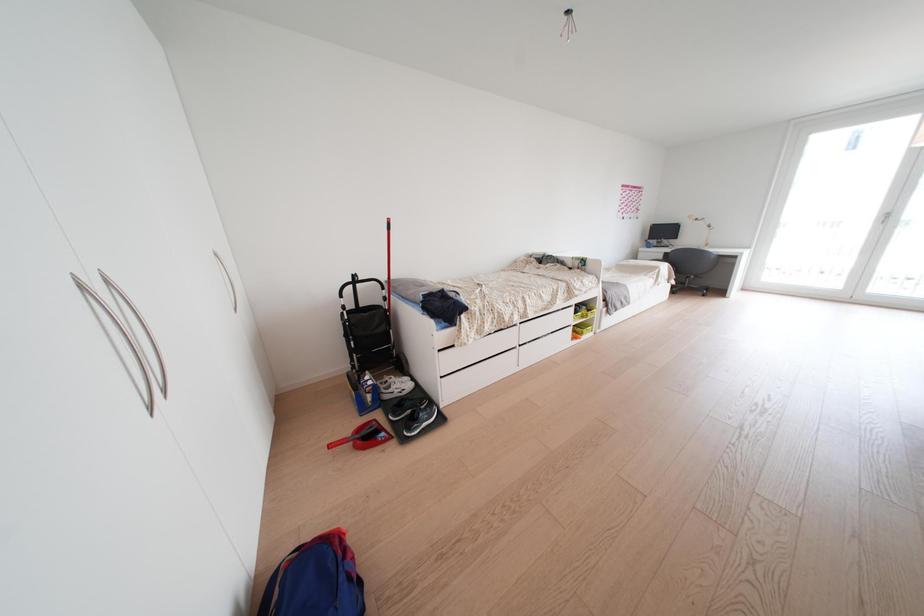
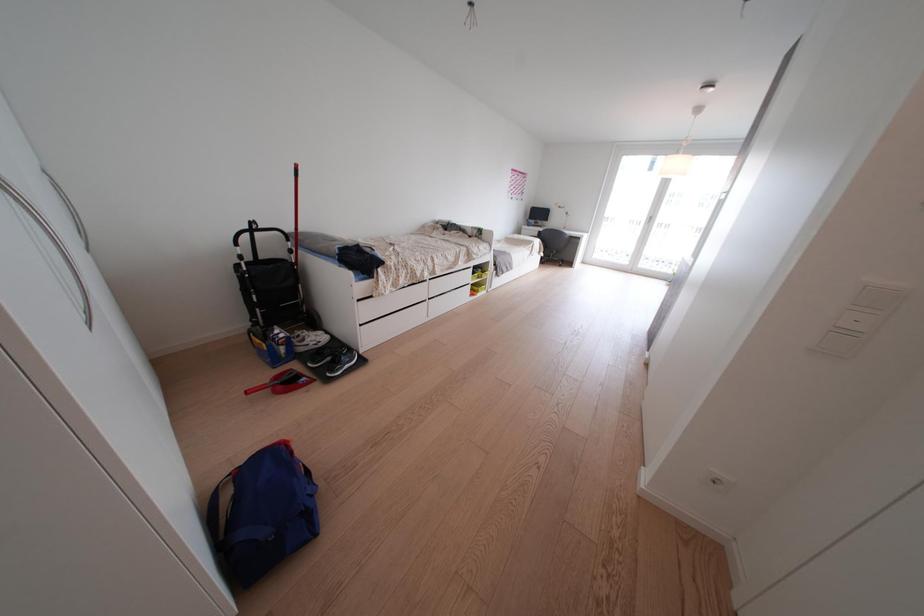
Question: The camera is either moving clockwise (left) or counter-clockwise (right) around the object. The first image is from the beginning of the video and the second image is from the end. Is the camera moving left or right when shooting the video?

Choices:
 (A) Left
 (B) Right

Answer: (A)